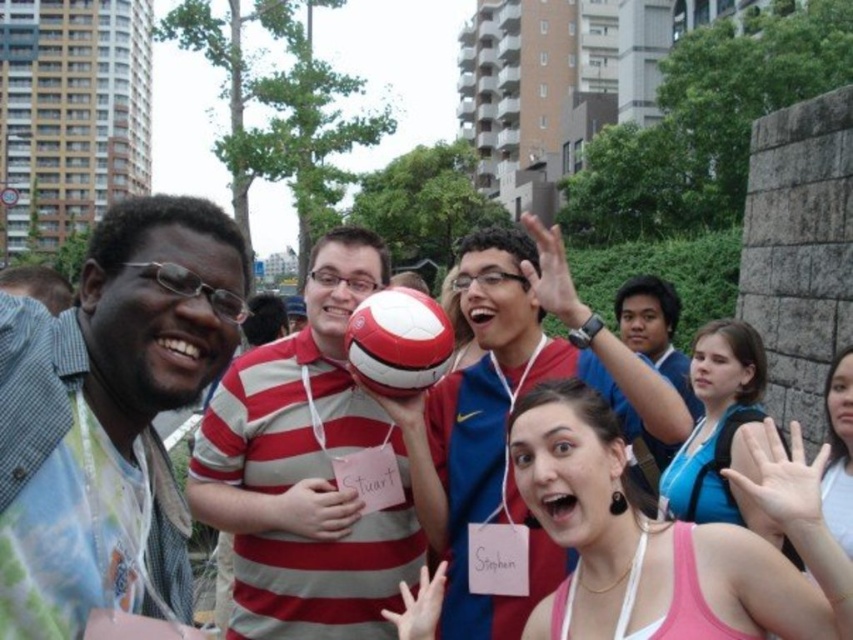
Question: Which of the following is the closest to the observer?

Choices:
 (A) (229, 531)
 (B) (514, 513)

Answer: (B)

Question: Is matte black shirt at left positioned in front of striped cotton polo shirt at center?

Choices:
 (A) yes
 (B) no

Answer: (A)

Question: Which object is positioned farthest from the striped cotton polo shirt at center?

Choices:
 (A) white matte soccer ball at center
 (B) red and white soccer ball at center

Answer: (B)

Question: Where is matte black shirt at left located in relation to red and white soccer ball at center in the image?

Choices:
 (A) above
 (B) below

Answer: (A)

Question: Is matte black shirt at left below red and white soccer ball at center?

Choices:
 (A) yes
 (B) no

Answer: (B)

Question: Among these objects, which one is farthest from the camera?

Choices:
 (A) red and white soccer ball at center
 (B) matte black shirt at left
 (C) striped cotton polo shirt at center

Answer: (C)